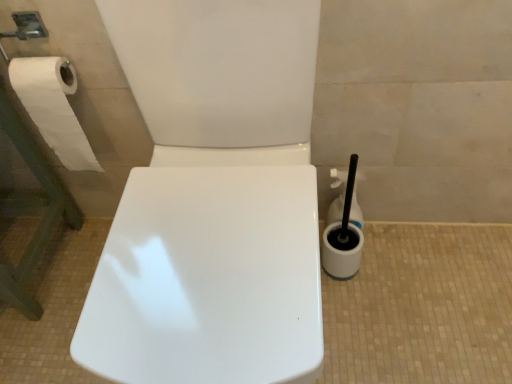
Measure the distance between point [37,121] and camera.

A distance of 99.00 centimeters exists between point [37,121] and camera.

Describe the element at coordinates (337, 197) in the screenshot. The width and height of the screenshot is (512, 384). I see `white plastic cleaning product at right, the first cleaning product viewed from the back` at that location.

Where is `white plastic toilet brush at right, which is the 1th cleaning product from front to back`? white plastic toilet brush at right, which is the 1th cleaning product from front to back is located at coordinates 343,237.

I want to click on white paper at left, so (x=53, y=107).

Is white paper at left turned away from white plastic cleaning product at right, which ranks as the second cleaning product in front-to-back order?

No, white plastic cleaning product at right, which ranks as the second cleaning product in front-to-back order, is not at the back of white paper at left.

Is white paper at left wider or thinner than white plastic cleaning product at right, which ranks as the second cleaning product in front-to-back order?

white paper at left is wider than white plastic cleaning product at right, which ranks as the second cleaning product in front-to-back order.

Does point (49, 70) come behind point (355, 223)?

No.

Is white paper at left to the left or to the right of white plastic cleaning product at right, the first cleaning product viewed from the back, in the image?

white paper at left is positioned on white plastic cleaning product at right, the first cleaning product viewed from the back,'s left side.

Which of these two, white plastic cleaning product at right, the first cleaning product viewed from the back, or white plastic toilet brush at right, which is the 1th cleaning product from front to back, stands shorter?

white plastic cleaning product at right, the first cleaning product viewed from the back, is shorter.

Considering the relative positions of white plastic cleaning product at right, the first cleaning product viewed from the back, and white plastic toilet brush at right, which is the 1th cleaning product from front to back, in the image provided, is white plastic cleaning product at right, the first cleaning product viewed from the back, to the left or to the right of white plastic toilet brush at right, which is the 1th cleaning product from front to back,?

In the image, white plastic cleaning product at right, the first cleaning product viewed from the back, appears on the right side of white plastic toilet brush at right, which is the 1th cleaning product from front to back.

Is point (342, 206) closer or farther from the camera than point (343, 220)?

Point (342, 206).

Considering the points (334, 219) and (53, 99), which point is behind, point (334, 219) or point (53, 99)?

The point (334, 219) is farther.

From the picture: From a real-world perspective, is white plastic cleaning product at right, the first cleaning product viewed from the back, above or below white paper at left?

white plastic cleaning product at right, the first cleaning product viewed from the back, is below white paper at left.

How many degrees apart are the facing directions of white plastic cleaning product at right, which ranks as the second cleaning product in front-to-back order, and white paper at left?

0.46 degrees separate the facing orientations of white plastic cleaning product at right, which ranks as the second cleaning product in front-to-back order, and white paper at left.

Between white plastic cleaning product at right, the first cleaning product viewed from the back, and white paper at left, which one appears on the right side from the viewer's perspective?

white plastic cleaning product at right, the first cleaning product viewed from the back.

From the image's perspective, is white plastic toilet brush at right, which is the 1th cleaning product from front to back, positioned above or below white plastic cleaning product at right, the first cleaning product viewed from the back?

white plastic toilet brush at right, which is the 1th cleaning product from front to back, is situated lower than white plastic cleaning product at right, the first cleaning product viewed from the back, in the image.

How different are the orientations of white plastic toilet brush at right, which is the 1th cleaning product from front to back, and white plastic cleaning product at right, the first cleaning product viewed from the back, in degrees?

white plastic toilet brush at right, which is the 1th cleaning product from front to back, and white plastic cleaning product at right, the first cleaning product viewed from the back, are facing 0.00186 degrees away from each other.

From a real-world perspective, is white plastic toilet brush at right, which is the 1th cleaning product from front to back, below white plastic cleaning product at right, the first cleaning product viewed from the back?

No, from a real-world perspective, white plastic toilet brush at right, which is the 1th cleaning product from front to back, is not beneath white plastic cleaning product at right, the first cleaning product viewed from the back.

In terms of height, does white plastic toilet brush at right, the second cleaning product viewed from the back, look taller or shorter compared to white plastic cleaning product at right, the first cleaning product viewed from the back?

Considering their sizes, white plastic toilet brush at right, the second cleaning product viewed from the back, has more height than white plastic cleaning product at right, the first cleaning product viewed from the back.

Are white paper at left and white plastic toilet brush at right, which is the 1th cleaning product from front to back, making contact?

No, white paper at left is not beside white plastic toilet brush at right, which is the 1th cleaning product from front to back.

Considering the sizes of white paper at left and white plastic toilet brush at right, which is the 1th cleaning product from front to back, in the image, is white paper at left bigger or smaller than white plastic toilet brush at right, which is the 1th cleaning product from front to back,?

In the image, white paper at left appears to be larger than white plastic toilet brush at right, which is the 1th cleaning product from front to back.

Is white paper at left positioned before white plastic toilet brush at right, the second cleaning product viewed from the back?

Yes, it is in front of white plastic toilet brush at right, the second cleaning product viewed from the back.

Is white plastic toilet brush at right, the second cleaning product viewed from the back, far from white paper at left?

That's not correct — white plastic toilet brush at right, the second cleaning product viewed from the back, is a little close to white paper at left.

Between white plastic toilet brush at right, which is the 1th cleaning product from front to back, and white paper at left, which one has less height?

Standing shorter between the two is white plastic toilet brush at right, which is the 1th cleaning product from front to back.

Considering their positions, is white plastic toilet brush at right, the second cleaning product viewed from the back, located in front of or behind white paper at left?

white plastic toilet brush at right, the second cleaning product viewed from the back, is behind white paper at left.

Locate an element on the screen. toilet paper on the left of white plastic toilet brush at right, the second cleaning product viewed from the back is located at coordinates (53, 107).

The image size is (512, 384). In order to click on the 2nd cleaning product below the white paper at left (from a real-world perspective) in this screenshot , I will do coord(337,197).

Where is `cleaning product located above the white plastic toilet brush at right, the second cleaning product viewed from the back (from the image's perspective)`? The height and width of the screenshot is (384, 512). cleaning product located above the white plastic toilet brush at right, the second cleaning product viewed from the back (from the image's perspective) is located at coordinates (337, 197).

Based on their spatial positions, is white plastic cleaning product at right, the first cleaning product viewed from the back, or white paper at left further from white plastic toilet brush at right, which is the 1th cleaning product from front to back?

The object further to white plastic toilet brush at right, which is the 1th cleaning product from front to back, is white paper at left.

Based on their spatial positions, is white paper at left or white plastic toilet brush at right, which is the 1th cleaning product from front to back, closer to white plastic cleaning product at right, which ranks as the second cleaning product in front-to-back order?

Among the two, white plastic toilet brush at right, which is the 1th cleaning product from front to back, is located nearer to white plastic cleaning product at right, which ranks as the second cleaning product in front-to-back order.

Consider the image. Considering their positions, is white paper at left positioned further to white plastic toilet brush at right, the second cleaning product viewed from the back, than white plastic cleaning product at right, which ranks as the second cleaning product in front-to-back order?

The object further to white plastic toilet brush at right, the second cleaning product viewed from the back, is white paper at left.

Looking at the image, which one is located further to white paper at left, white plastic toilet brush at right, the second cleaning product viewed from the back, or white plastic cleaning product at right, the first cleaning product viewed from the back?

Based on the image, white plastic toilet brush at right, the second cleaning product viewed from the back, appears to be further to white paper at left.

Estimate the real-world distances between objects in this image. Which object is further from white plastic cleaning product at right, which ranks as the second cleaning product in front-to-back order, white plastic toilet brush at right, the second cleaning product viewed from the back, or white paper at left?

Among the two, white paper at left is located further to white plastic cleaning product at right, which ranks as the second cleaning product in front-to-back order.

Estimate the real-world distances between objects in this image. Which object is closer to white paper at left, white plastic cleaning product at right, the first cleaning product viewed from the back, or white plastic toilet brush at right, the second cleaning product viewed from the back?

Among the two, white plastic cleaning product at right, the first cleaning product viewed from the back, is located nearer to white paper at left.

Locate an element on the screen. Image resolution: width=512 pixels, height=384 pixels. cleaning product situated between white paper at left and white plastic cleaning product at right, which ranks as the second cleaning product in front-to-back order, from left to right is located at coordinates (343, 237).